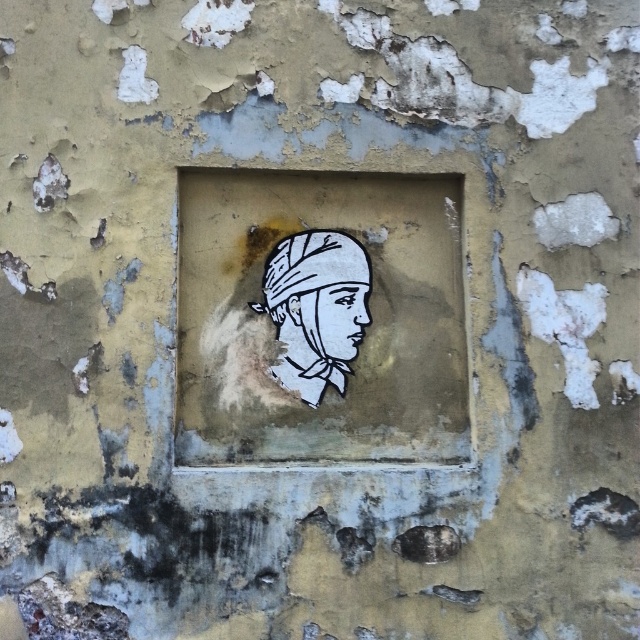
Question: Is white paper-like at center positioned in front of white paper-like face at center?

Choices:
 (A) no
 (B) yes

Answer: (B)

Question: Based on their relative distances, which object is nearer to the white paper-like face at center?

Choices:
 (A) white paper at center
 (B) white paper-like at center

Answer: (A)

Question: Based on their relative distances, which object is farther from the white paper at center?

Choices:
 (A) white paper-like face at center
 (B) white paper-like at center

Answer: (B)

Question: Estimate the real-world distances between objects in this image. Which object is closer to the white paper at center?

Choices:
 (A) white paper-like at center
 (B) white paper-like face at center

Answer: (B)

Question: Can you confirm if white paper at center is positioned to the left of white paper-like face at center?

Choices:
 (A) yes
 (B) no

Answer: (A)

Question: Is white paper at center closer to camera compared to white paper-like face at center?

Choices:
 (A) no
 (B) yes

Answer: (B)